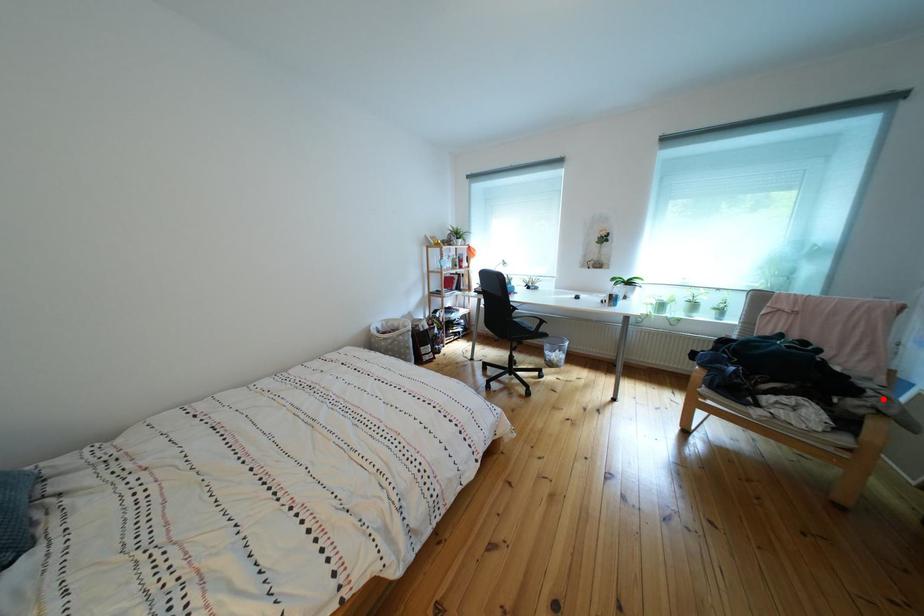
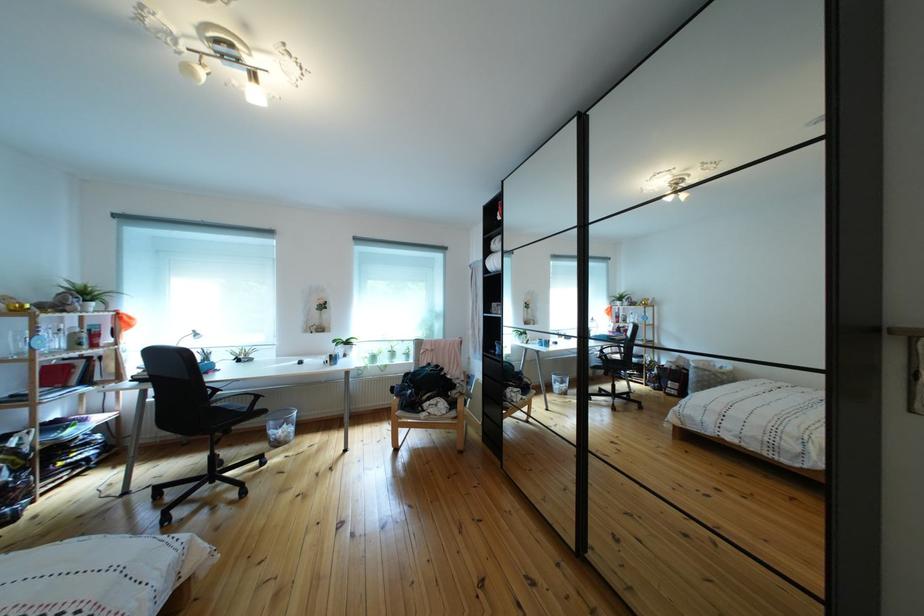
Find the pixel in the second image that matches the highlighted location in the first image.

(469, 391)